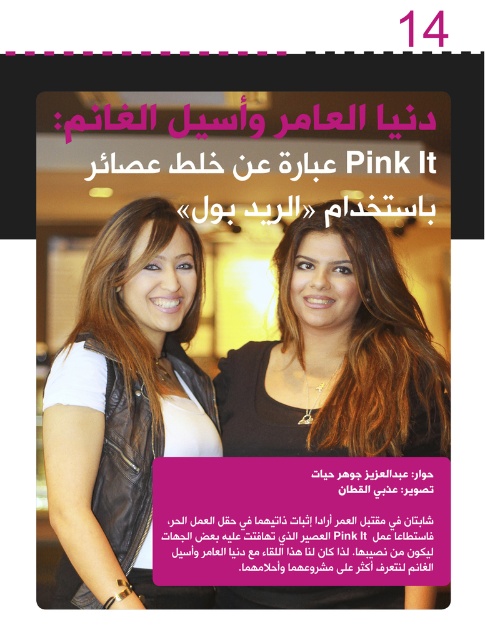
You are a photographer who wants to ensure the leather jacket at center is visible in the photo. Based on the scene description, where should you position the camera relative to the two women?

The leather jacket at center is located at point (126, 406), so the camera should be positioned to capture that coordinate to ensure the jacket is visible.

You are a photographer trying to capture a clear shot of both the matte black vest at center and the pink matte text at center in the image. Based on their positions, which object is located to the left of the other?

The pink matte text at center is positioned to the left of the matte black vest at center.

You are standing in front of the two women in the image. There are two points marked in the scene. One is at coordinate point [123,340] and the other is at point [321,436]. Which point is closer to you?

Point [321,436] is closer to you because it is in front of point [123,340].